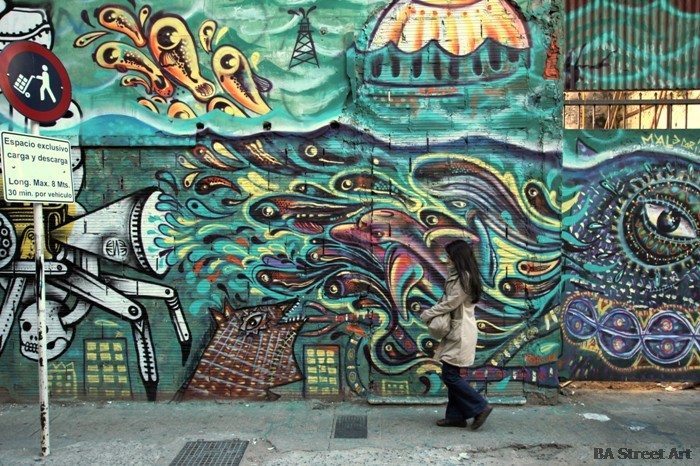
At what (x,y) coordinates should I click in order to perform the action: click on mural. Please return your answer as a coordinate pair (x, y). The height and width of the screenshot is (466, 700). Looking at the image, I should click on coord(283,200).